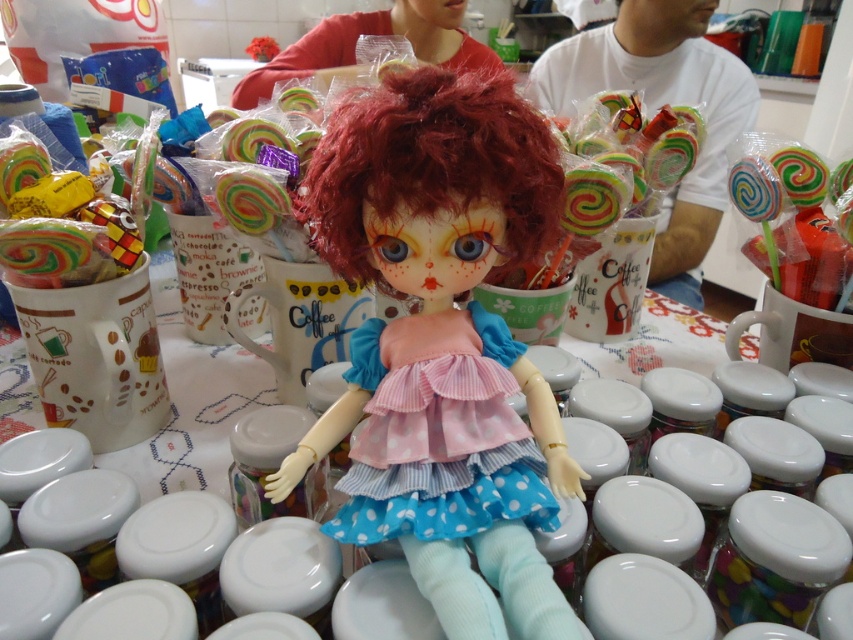
Question: Among these objects, which one is nearest to the camera?

Choices:
 (A) multicolored lollipop at center
 (B) pink fabric dress at center

Answer: (B)

Question: Does satin red wig at center have a greater width compared to multicolored lollipop at center?

Choices:
 (A) no
 (B) yes

Answer: (B)

Question: Which of the following is the closest to the observer?

Choices:
 (A) pink fabric dress at center
 (B) satin red wig at center

Answer: (B)

Question: Which of these objects is positioned farthest from the satin red wig at center?

Choices:
 (A) multicolored lollipop at upper right
 (B) matte plastic doll at center

Answer: (A)

Question: From the image, what is the correct spatial relationship of multicolored lollipop at center in relation to multicolored spiral lollipop at center?

Choices:
 (A) right
 (B) left

Answer: (B)

Question: Is matte plastic doll at center above multicolored lollipop at upper right?

Choices:
 (A) yes
 (B) no

Answer: (B)